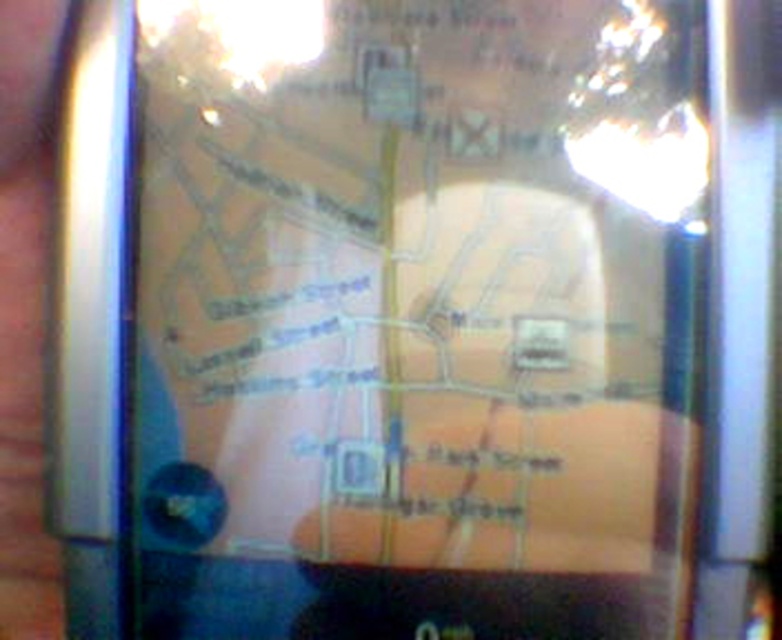
This screenshot has height=640, width=782. What do you see at coordinates (418, 317) in the screenshot?
I see `translucent plastic map at center` at bounding box center [418, 317].

Locate an element on the screen. translucent plastic map at center is located at coordinates (418, 317).